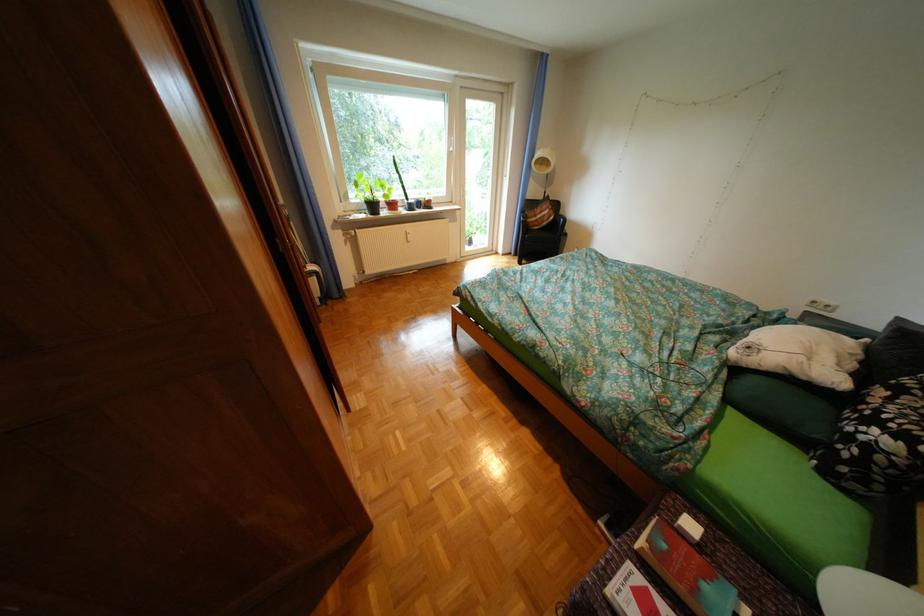
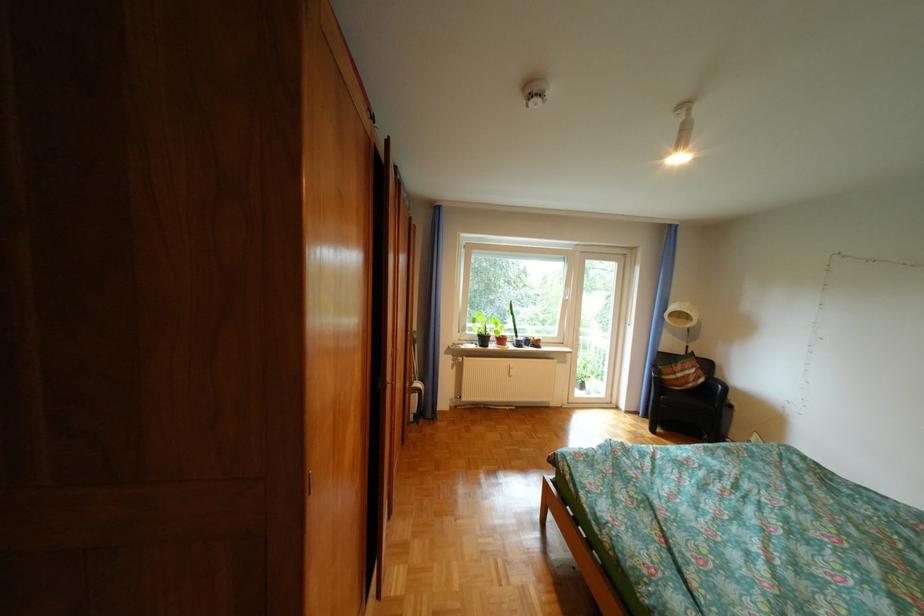
How did the camera likely rotate?

The rotation direction of the camera is left-up.